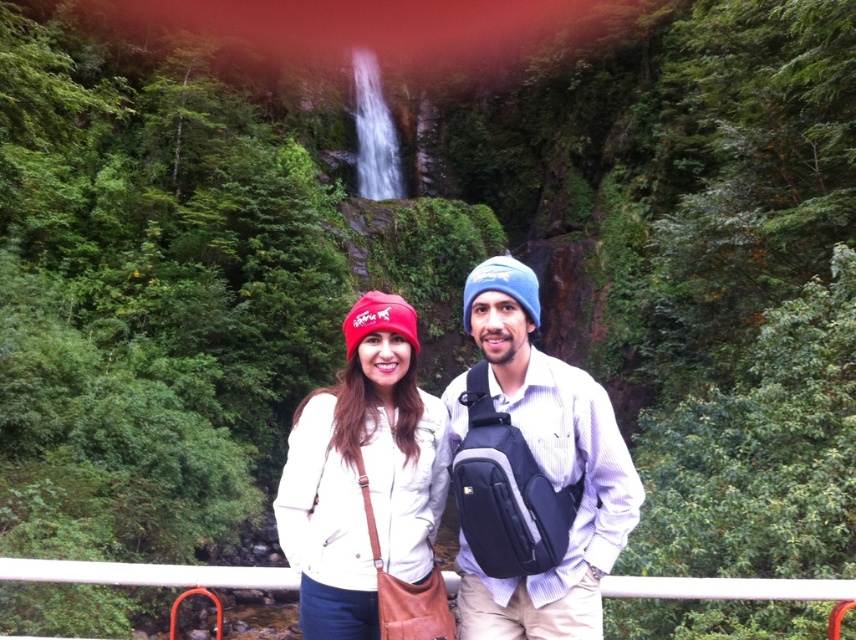
Question: Which point is closer to the camera?

Choices:
 (A) (327, 573)
 (B) (586, 636)

Answer: (B)

Question: Is blue fabric beanie at center thinner than matte red beanie at center?

Choices:
 (A) yes
 (B) no

Answer: (B)

Question: Can you confirm if blue fabric beanie at center is wider than matte red beanie at center?

Choices:
 (A) no
 (B) yes

Answer: (B)

Question: Can you confirm if blue fabric beanie at center is positioned to the left of matte red beanie at center?

Choices:
 (A) yes
 (B) no

Answer: (B)